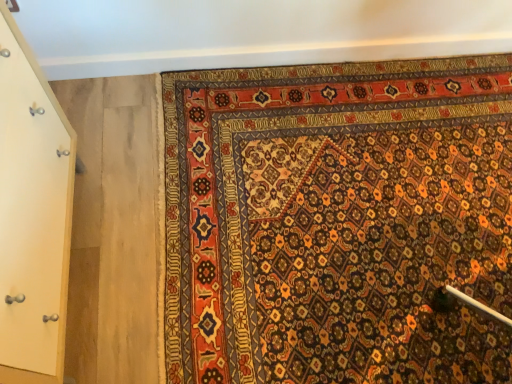
Question: Considering the positions of light wood door at left and carpet with intricate patterns at lower right in the image, is light wood door at left wider or thinner than carpet with intricate patterns at lower right?

Choices:
 (A) wide
 (B) thin

Answer: (B)

Question: In the image, is light wood door at left positioned in front of or behind carpet with intricate patterns at lower right?

Choices:
 (A) front
 (B) behind

Answer: (A)

Question: From their relative heights in the image, would you say light wood door at left is taller or shorter than carpet with intricate patterns at lower right?

Choices:
 (A) short
 (B) tall

Answer: (B)

Question: Considering their positions, is carpet with intricate patterns at lower right located in front of or behind light wood door at left?

Choices:
 (A) front
 (B) behind

Answer: (B)

Question: Looking at their shapes, would you say carpet with intricate patterns at lower right is wider or thinner than light wood door at left?

Choices:
 (A) wide
 (B) thin

Answer: (A)

Question: From a real-world perspective, is carpet with intricate patterns at lower right above or below light wood door at left?

Choices:
 (A) below
 (B) above

Answer: (A)

Question: Does point (301, 208) appear closer or farther from the camera than point (41, 284)?

Choices:
 (A) farther
 (B) closer

Answer: (A)